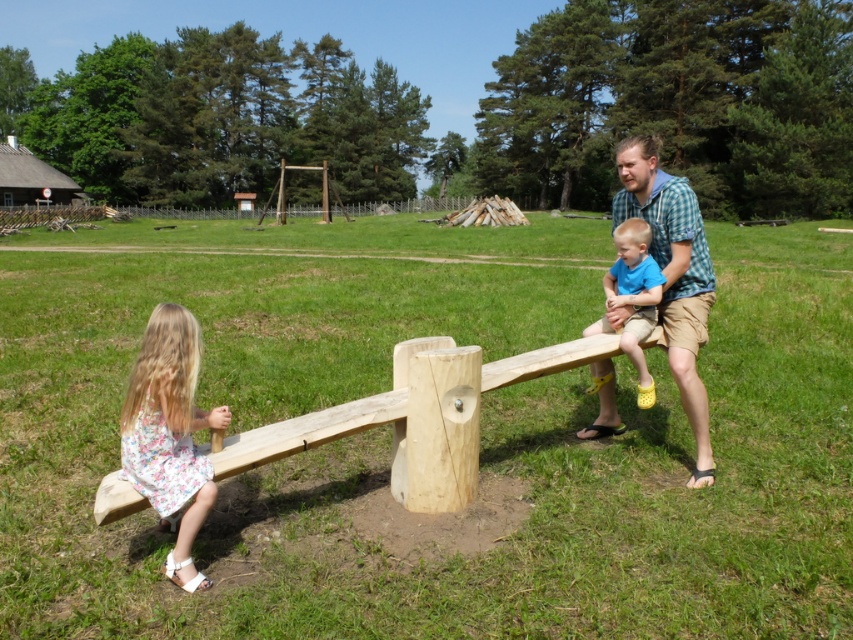
Question: Estimate the real-world distances between objects in this image. Which object is farther from the checkered fabric shirt at right?

Choices:
 (A) blue cotton shirt at right
 (B) floral fabric dress at left

Answer: (B)

Question: Does floral fabric dress at left come in front of blue cotton shirt at right?

Choices:
 (A) no
 (B) yes

Answer: (B)

Question: Does checkered fabric shirt at right have a lesser width compared to blue cotton shirt at right?

Choices:
 (A) yes
 (B) no

Answer: (B)

Question: Does floral fabric dress at left lie behind checkered fabric shirt at right?

Choices:
 (A) yes
 (B) no

Answer: (B)

Question: Which of these objects is positioned farthest from the blue cotton shirt at right?

Choices:
 (A) checkered fabric shirt at right
 (B) floral fabric dress at left

Answer: (B)

Question: Which point is closer to the camera taking this photo?

Choices:
 (A) (642, 397)
 (B) (138, 484)
 (C) (712, 296)

Answer: (B)